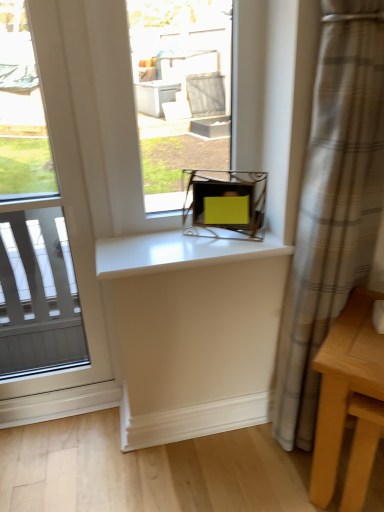
This screenshot has height=512, width=384. What do you see at coordinates (332, 206) in the screenshot?
I see `plaid fabric curtain at right` at bounding box center [332, 206].

Measure the distance between point [228,222] and camera.

Point [228,222] is 1.22 meters from camera.

What is the approximate height of matte yellow box at center, which is the 1th window from right to left?

It is 61.68 centimeters.

The width and height of the screenshot is (384, 512). Describe the element at coordinates (180, 91) in the screenshot. I see `matte yellow box at center, which is the 2th window from left to right` at that location.

What are the coordinates of `plaid fabric curtain at right` in the screenshot? It's located at (332, 206).

In terms of width, does light wood table at lower right look wider or thinner when compared to plaid fabric curtain at right?

Clearly, light wood table at lower right has more width compared to plaid fabric curtain at right.

From the picture: Which point is more distant from viewer, (x=322, y=400) or (x=307, y=338)?

The point (x=307, y=338) is farther.

In terms of size, does light wood table at lower right appear bigger or smaller than plaid fabric curtain at right?

light wood table at lower right is smaller than plaid fabric curtain at right.

How different are the orientations of light wood table at lower right and plaid fabric curtain at right in degrees?

They differ by 46.1 degrees in their facing directions.

Which is closer, (156, 239) or (343, 370)?

The point (343, 370) is in front.

At what (x,y) coordinates should I click in order to perform the action: click on table that appears on the right of white glossy counter top at center. Please return your answer as a coordinate pair (x, y). This screenshot has height=512, width=384. Looking at the image, I should click on (343, 386).

Is white glossy counter top at center facing away from light wood table at lower right?

No.

Does white glossy counter top at center contain light wood table at lower right?

No, light wood table at lower right is not a part of white glossy counter top at center.

Is plaid fabric curtain at right to the left of light wood table at lower right from the viewer's perspective?

Yes.

Considering the positions of points (322, 260) and (347, 345), is point (322, 260) closer to camera compared to point (347, 345)?

No, (322, 260) is behind (347, 345).

Is plaid fabric curtain at right positioned in front of light wood table at lower right?

Yes, plaid fabric curtain at right is in front of light wood table at lower right.

Is plaid fabric curtain at right completely or partially outside of matte yellow box at center, which is the 2th window from left to right?

plaid fabric curtain at right is positioned outside matte yellow box at center, which is the 2th window from left to right.

Between plaid fabric curtain at right and matte yellow box at center, which is the 1th window from right to left, which one appears on the right side from the viewer's perspective?

plaid fabric curtain at right.

From the image's perspective, relative to matte yellow box at center, which is the 2th window from left to right, is plaid fabric curtain at right above or below?

plaid fabric curtain at right is situated lower than matte yellow box at center, which is the 2th window from left to right, in the image.

Can you tell me how much light wood table at lower right and white glossy counter top at center differ in facing direction?

The angular difference between light wood table at lower right and white glossy counter top at center is 45 degrees.

Who is more distant, light wood table at lower right or white glossy counter top at center?

white glossy counter top at center is behind.

From the image's perspective, between light wood table at lower right and white glossy counter top at center, who is located below?

From the image's view, light wood table at lower right is below.

Is there a large distance between light wood table at lower right and white glossy counter top at center?

No, light wood table at lower right is not far from white glossy counter top at center.

Which is in front, point (201, 27) or point (248, 234)?

The point (248, 234) is in front.

From a real-world perspective, which is physically below, matte yellow box at center, which is the 2th window from left to right, or yellow matte box at center?

In real-world perspective, yellow matte box at center is lower.

From the image's perspective, relative to yellow matte box at center, is matte yellow box at center, which is the 1th window from right to left, above or below?

matte yellow box at center, which is the 1th window from right to left, is above yellow matte box at center.

Is matte yellow box at center, which is the 2th window from left to right, bigger or smaller than yellow matte box at center?

Clearly, matte yellow box at center, which is the 2th window from left to right, is larger in size than yellow matte box at center.

Consider the image. What's the angular difference between white glossy counter top at center and matte yellow box at center, which is the 2th window from left to right,'s facing directions?

0.0754 degrees.

Is white glossy counter top at center turned away from matte yellow box at center, which is the 1th window from right to left?

No, matte yellow box at center, which is the 1th window from right to left, is not at the back of white glossy counter top at center.

Considering the sizes of white glossy counter top at center and matte yellow box at center, which is the 1th window from right to left, in the image, is white glossy counter top at center taller or shorter than matte yellow box at center, which is the 1th window from right to left,?

Considering their sizes, white glossy counter top at center has less height than matte yellow box at center, which is the 1th window from right to left.

Is white glossy counter top at center directly adjacent to matte yellow box at center, which is the 1th window from right to left?

They are not placed beside each other.

You are a GUI agent. You are given a task and a screenshot of the screen. Output one action in this format:
    pyautogui.click(x=<x>, y=<y>)
    Task: Click on the curtain lying in front of the light wood table at lower right
    
    Given the screenshot: What is the action you would take?
    pyautogui.click(x=332, y=206)

Locate an element on the screen. This screenshot has width=384, height=512. counter top lying on the left of light wood table at lower right is located at coordinates (177, 252).

Consider the image. From the image, which object appears to be farther from clear glass window at left, which appears as the second window when viewed from the right, yellow matte box at center or plaid fabric curtain at right?

plaid fabric curtain at right lies further to clear glass window at left, which appears as the second window when viewed from the right, than the other object.

Estimate the real-world distances between objects in this image. Which object is closer to plaid fabric curtain at right, yellow matte box at center or light wood table at lower right?

light wood table at lower right is closer to plaid fabric curtain at right.

Which object lies nearer to the anchor point white glossy counter top at center, clear glass window at left, positioned as the 1th window in left-to-right order, or light wood table at lower right?

clear glass window at left, positioned as the 1th window in left-to-right order, is positioned closer to the anchor white glossy counter top at center.

Based on their spatial positions, is matte yellow box at center, which is the 2th window from left to right, or clear glass window at left, which appears as the second window when viewed from the right, closer to white glossy counter top at center?

clear glass window at left, which appears as the second window when viewed from the right, is closer to white glossy counter top at center.

Looking at the image, which one is located closer to matte yellow box at center, which is the 2th window from left to right, white glossy counter top at center or plaid fabric curtain at right?

Based on the image, white glossy counter top at center appears to be nearer to matte yellow box at center, which is the 2th window from left to right.

Based on their spatial positions, is white glossy counter top at center or plaid fabric curtain at right further from clear glass window at left, which appears as the second window when viewed from the right?

plaid fabric curtain at right.

When comparing their distances from plaid fabric curtain at right, does yellow matte box at center or clear glass window at left, positioned as the 1th window in left-to-right order, seem further?

Among the two, clear glass window at left, positioned as the 1th window in left-to-right order, is located further to plaid fabric curtain at right.

Considering their positions, is clear glass window at left, which appears as the second window when viewed from the right, positioned closer to light wood table at lower right than plaid fabric curtain at right?

plaid fabric curtain at right is positioned closer to the anchor light wood table at lower right.

Locate an element on the screen. curtain that lies between yellow matte box at center and light wood table at lower right from top to bottom is located at coordinates (332, 206).

I want to click on counter top located between matte yellow box at center, which is the 1th window from right to left, and plaid fabric curtain at right in the left-right direction, so click(177, 252).

Locate an element on the screen. counter top situated between clear glass window at left, positioned as the 1th window in left-to-right order, and plaid fabric curtain at right from left to right is located at coordinates (177, 252).

Locate an element on the screen. counter top between plaid fabric curtain at right and yellow matte box at center from front to back is located at coordinates (177, 252).